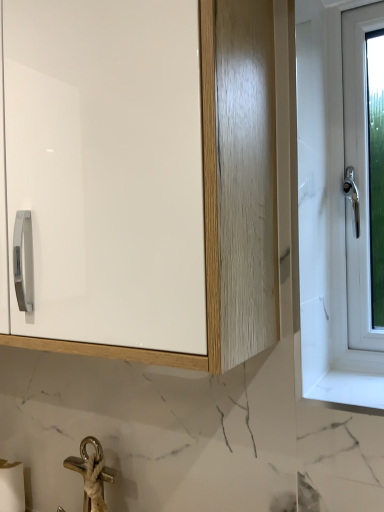
Question: In terms of height, does white matte toilet paper at lower left look taller or shorter compared to white glossy cabinet at upper left?

Choices:
 (A) tall
 (B) short

Answer: (B)

Question: Looking at their shapes, would you say white matte toilet paper at lower left is wider or thinner than white glossy cabinet at upper left?

Choices:
 (A) thin
 (B) wide

Answer: (A)

Question: Is white matte toilet paper at lower left in front of or behind white glossy cabinet at upper left in the image?

Choices:
 (A) behind
 (B) front

Answer: (A)

Question: Would you say white glossy cabinet at upper left is inside or outside white matte toilet paper at lower left?

Choices:
 (A) inside
 (B) outside

Answer: (B)

Question: From a real-world perspective, is white glossy cabinet at upper left above or below white matte toilet paper at lower left?

Choices:
 (A) above
 (B) below

Answer: (A)

Question: From the image's perspective, relative to white matte toilet paper at lower left, is white glossy cabinet at upper left above or below?

Choices:
 (A) below
 (B) above

Answer: (B)

Question: In terms of size, does white glossy cabinet at upper left appear bigger or smaller than white matte toilet paper at lower left?

Choices:
 (A) small
 (B) big

Answer: (B)